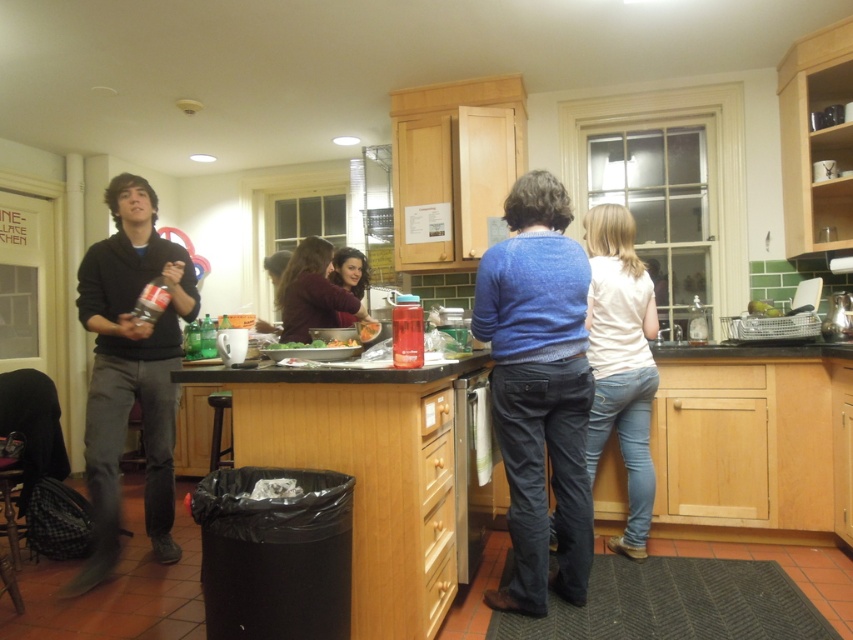
Can you confirm if blue sweater at center is positioned to the right of matte purple sweater at center?

Yes, blue sweater at center is to the right of matte purple sweater at center.

Consider the image. Between blue sweater at center and matte purple sweater at center, which one appears on the right side from the viewer's perspective?

blue sweater at center is more to the right.

Locate an element on the screen. The image size is (853, 640). blue sweater at center is located at coordinates (538, 388).

Image resolution: width=853 pixels, height=640 pixels. Identify the location of blue sweater at center. (538, 388).

Is point (699, 307) farther from camera compared to point (293, 342)?

Yes.

Is clear glass bottle at center taller than green leafy vegetables at center?

Yes.

Is point (695, 308) positioned in front of point (352, 346)?

No, it is not.

At what (x,y) coordinates should I click in order to perform the action: click on clear glass bottle at center. Please return your answer as a coordinate pair (x, y). Looking at the image, I should click on (697, 321).

Does point (480, 321) come farther from viewer compared to point (294, 336)?

No, (480, 321) is closer to viewer.

Who is more distant from viewer, (520,541) or (308,337)?

Point (308,337)

Where is `blue sweater at center`? Image resolution: width=853 pixels, height=640 pixels. blue sweater at center is located at coordinates (538, 388).

Locate an element on the screen. This screenshot has height=640, width=853. blue sweater at center is located at coordinates (538, 388).